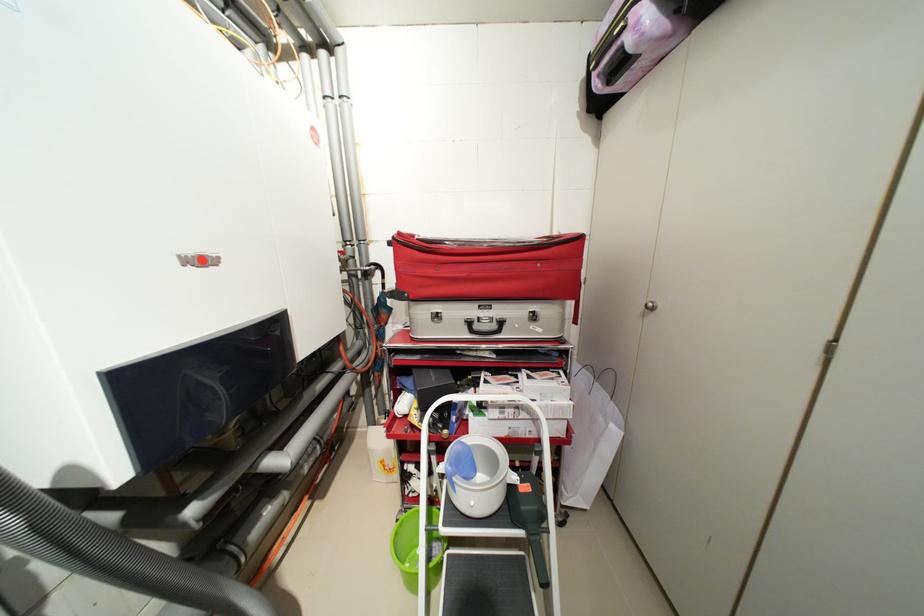
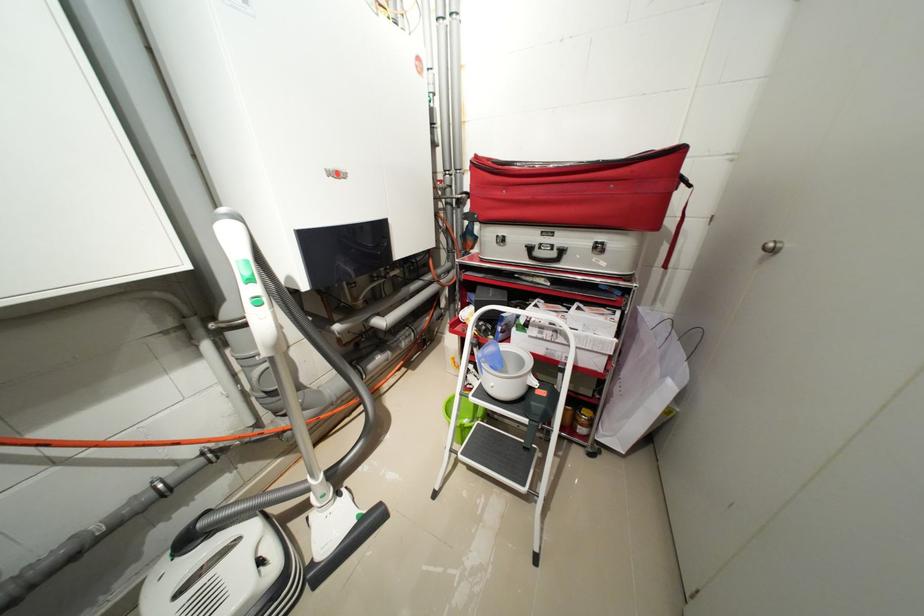
Question: The camera is either moving clockwise (left) or counter-clockwise (right) around the object. The first image is from the beginning of the video and the second image is from the end. Is the camera moving left or right when shooting the video?

Choices:
 (A) Left
 (B) Right

Answer: (B)